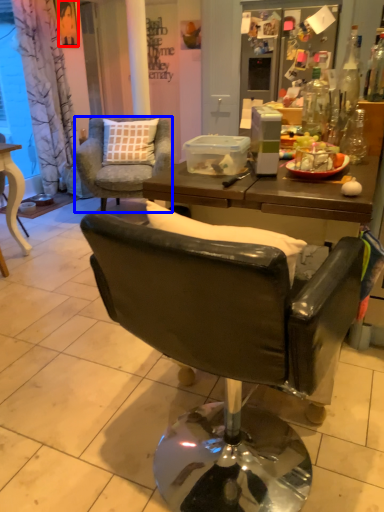
Question: Which object appears closest to the camera in this image, person (highlighted by a red box) or chair (highlighted by a blue box)?

Choices:
 (A) person
 (B) chair

Answer: (B)